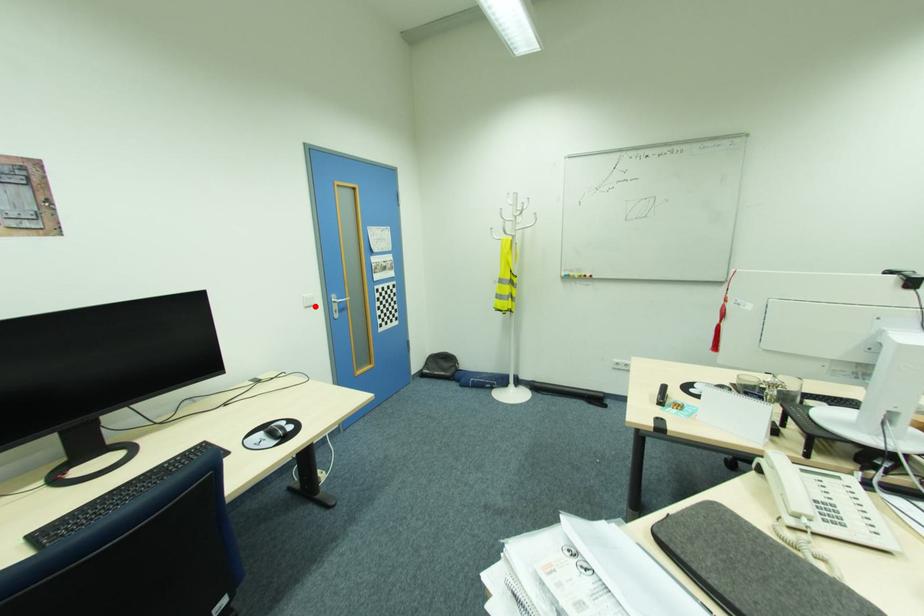
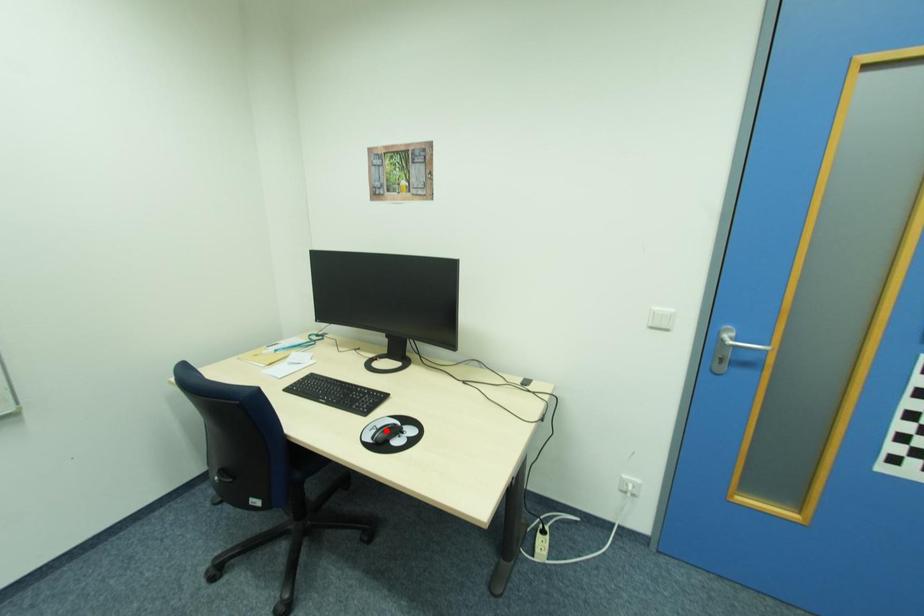
I am providing you with two images of the same scene from different viewpoints. A red point is marked on the first image and another point is marked on the second image. Do the highlighted points in image1 and image2 indicate the same real-world spot?

No